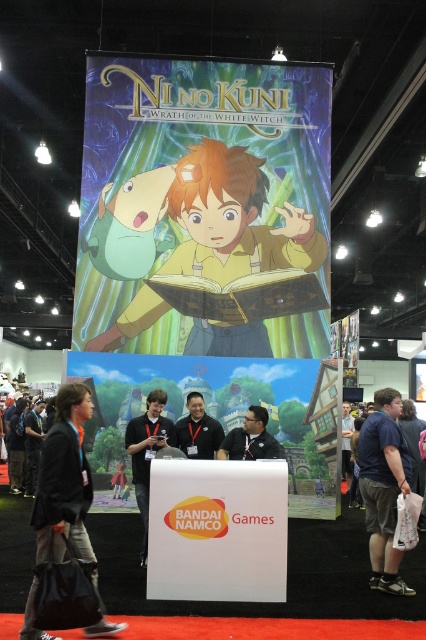
You are an attendee at the Ni no Kuni booth and want to take a photo with the promotional banner. There are two people in front of you wearing a matte yellow shirt at center and a dark blue shirt at lower right. Which shirt should you focus on to ensure the banner is visible in your photo?

The matte yellow shirt at center is positioned over the dark blue shirt at lower right, so focusing on the dark blue shirt at lower right will allow the banner to be visible behind them.

Based on the photo, you are an attendee at the gaming expo and see two shirts displayed at the Ni no Kuni booth. The shirts are labeled as matte black shirt at center and black fabric shirt at center. Which shirt is positioned to the left when viewed from your perspective?

The matte black shirt at center is positioned to the left of the black fabric shirt at center.

You are an event organizer at the gaming expo and need to place a 1.2 meter wide promotional stand between the black fabric jacket at lower left and the dark brown leather jacket at center. Is there enough space?

The black fabric jacket at lower left is wider than the dark brown leather jacket at center. However, the exact distance between them isn not provided in the description. Therefore, it is uncertain if the 1.2 meter wide promotional stand can fit between them without more information about the spacing between the two jackets.